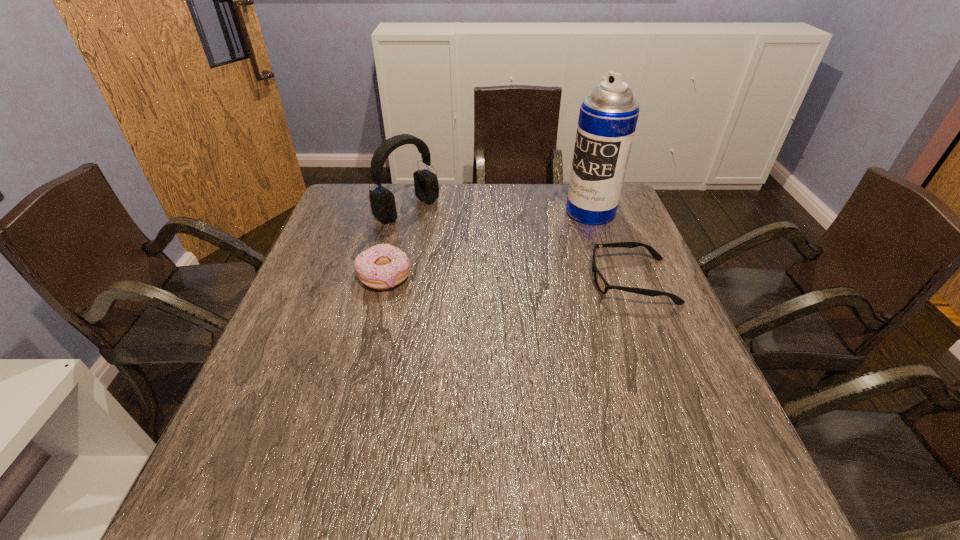
Locate an element on the screen. empty space that is in between the aerosol can and the second shortest object is located at coordinates (488, 245).

Image resolution: width=960 pixels, height=540 pixels. Find the location of `free space between the doughnut and the spectacles`. free space between the doughnut and the spectacles is located at coordinates (508, 279).

I want to click on free space that is in between the third tallest object and the third shortest object, so click(396, 243).

Find the location of a particular element. Image resolution: width=960 pixels, height=540 pixels. empty space that is in between the aerosol can and the third shortest object is located at coordinates (499, 211).

You are a GUI agent. You are given a task and a screenshot of the screen. Output one action in this format:
    pyautogui.click(x=<x>, y=<y>)
    Task: Click on the vacant area that lies between the headset and the spectacles
    The image size is (960, 540).
    Given the screenshot: What is the action you would take?
    pyautogui.click(x=519, y=245)

Find the location of a particular element. vacant area between the headset and the tallest object is located at coordinates (499, 211).

Locate which object ranks third in proximity to the third tallest object. Please provide its 2D coordinates. Your answer should be formatted as a tuple, i.e. [(x, y)], where the tuple contains the x and y coordinates of a point satisfying the conditions above.

[(608, 116)]

Identify the location of object identified as the closest to the doughnut. (382, 200).

The height and width of the screenshot is (540, 960). I want to click on vacant space that satisfies the following two spatial constraints: 1. on the back side of the aerosol can; 2. on the right side of the doughnut, so click(x=400, y=212).

You are a GUI agent. You are given a task and a screenshot of the screen. Output one action in this format:
    pyautogui.click(x=<x>, y=<y>)
    Task: Click on the vacant space that satisfies the following two spatial constraints: 1. on the back side of the headset; 2. on the left side of the doughnut
    Image resolution: width=960 pixels, height=540 pixels.
    Given the screenshot: What is the action you would take?
    pyautogui.click(x=401, y=209)